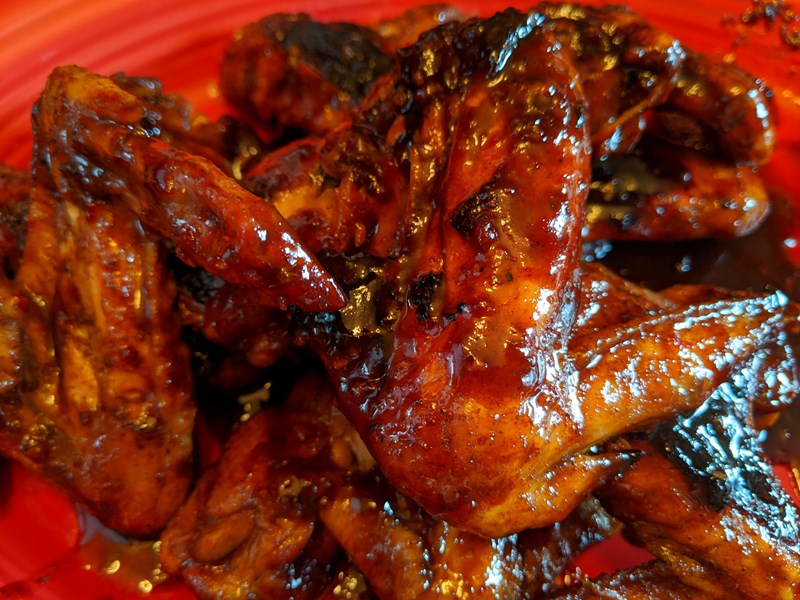
Locate an element on the screen. red plate is located at coordinates (108, 34).